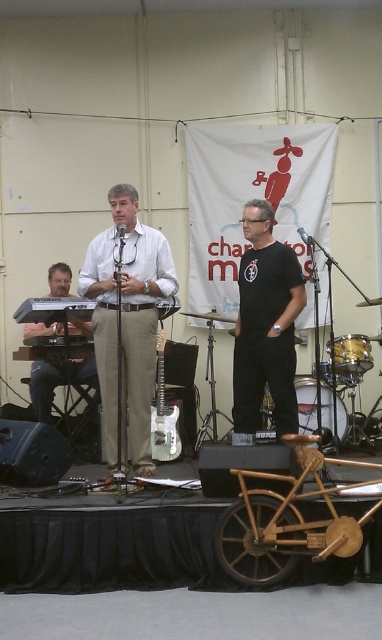
Question: Considering the relative positions of satin white electric guitar at center and metallic silver microphone at center in the image provided, where is satin white electric guitar at center located with respect to metallic silver microphone at center?

Choices:
 (A) above
 (B) below

Answer: (B)

Question: Which point appears farthest from the camera in this image?

Choices:
 (A) (43, 376)
 (B) (147, 436)
 (C) (260, 291)

Answer: (A)

Question: Can you confirm if matte black keyboard at left is positioned above satin white electric guitar at center?

Choices:
 (A) yes
 (B) no

Answer: (A)

Question: Which point is closer to the camera?

Choices:
 (A) matte black keyboard at left
 (B) metallic silver microphone at center

Answer: (A)

Question: Can you confirm if black matte t-shirt at center is positioned below black matte microphone at center?

Choices:
 (A) no
 (B) yes

Answer: (B)

Question: Which point is closer to the camera taking this photo?

Choices:
 (A) (119, 230)
 (B) (280, 346)
 (C) (310, 243)
 (D) (113, 205)

Answer: (A)